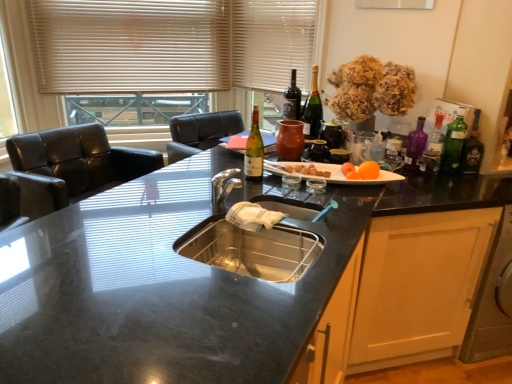
Question: Does black granite countertop at center appear on the right side of matte glass wine bottle at upper right?

Choices:
 (A) no
 (B) yes

Answer: (A)

Question: Is black granite countertop at center bigger than matte glass wine bottle at upper right?

Choices:
 (A) yes
 (B) no

Answer: (A)

Question: Is black granite countertop at center positioned far away from matte glass wine bottle at upper right?

Choices:
 (A) no
 (B) yes

Answer: (A)

Question: Can you confirm if black granite countertop at center is thinner than matte glass wine bottle at upper right?

Choices:
 (A) no
 (B) yes

Answer: (A)

Question: Can you confirm if black granite countertop at center is wider than matte glass wine bottle at upper right?

Choices:
 (A) yes
 (B) no

Answer: (A)

Question: From their relative heights in the image, would you say orange matte at upper center is taller or shorter than purple glass bottle at right, the third bottle positioned from the right?

Choices:
 (A) tall
 (B) short

Answer: (B)

Question: Would you say orange matte at upper center is inside or outside purple glass bottle at right, the 3th bottle when ordered from left to right?

Choices:
 (A) outside
 (B) inside

Answer: (A)

Question: Visually, is orange matte at upper center positioned to the left or to the right of purple glass bottle at right, the 3th bottle when ordered from left to right?

Choices:
 (A) right
 (B) left

Answer: (B)

Question: Considering the positions of point (345, 170) and point (411, 145), is point (345, 170) closer or farther from the camera than point (411, 145)?

Choices:
 (A) farther
 (B) closer

Answer: (B)

Question: From the image's perspective, is matte glass wine bottle at center, positioned as the fifth bottle in back-to-front order, positioned above or below green glass bottle at right, the 5th bottle viewed from the left?

Choices:
 (A) below
 (B) above

Answer: (B)

Question: In terms of width, does matte glass wine bottle at center, positioned as the fifth bottle in back-to-front order, look wider or thinner when compared to green glass bottle at right, which ranks as the 2th bottle in back-to-front order?

Choices:
 (A) thin
 (B) wide

Answer: (B)

Question: Is matte glass wine bottle at center, which appears as the fifth bottle when viewed from the right, taller or shorter than green glass bottle at right, marked as the 4th bottle in a front-to-back arrangement?

Choices:
 (A) short
 (B) tall

Answer: (B)

Question: Is point (256, 115) closer or farther from the camera than point (476, 114)?

Choices:
 (A) closer
 (B) farther

Answer: (A)

Question: Considering the positions of point (365, 172) and point (17, 339), is point (365, 172) closer or farther from the camera than point (17, 339)?

Choices:
 (A) closer
 (B) farther

Answer: (B)

Question: In terms of size, does orange matte at upper right appear bigger or smaller than black granite countertop at center?

Choices:
 (A) small
 (B) big

Answer: (A)